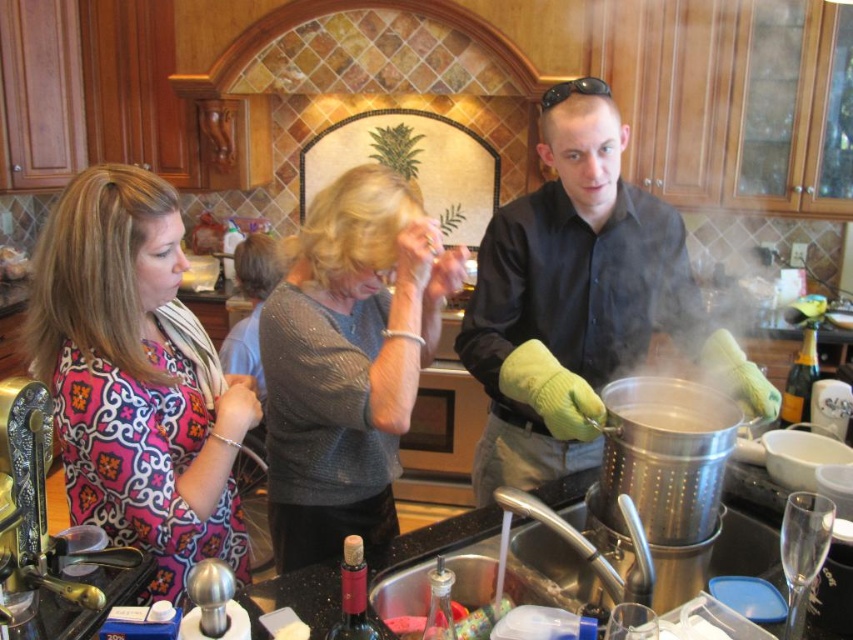
Question: Is matte black shirt at center further to camera compared to sparkly gray sweater at center?

Choices:
 (A) yes
 (B) no

Answer: (A)

Question: Does pink patterned blouse at left have a greater width compared to matte black shirt at center?

Choices:
 (A) no
 (B) yes

Answer: (A)

Question: Which of the following is the closest to the observer?

Choices:
 (A) pink patterned blouse at left
 (B) matte black shirt at center
 (C) sparkly gray sweater at center

Answer: (A)

Question: Which of the following is the farthest from the observer?

Choices:
 (A) matte black shirt at center
 (B) sparkly gray sweater at center

Answer: (A)

Question: Which point is farther from the camera taking this photo?

Choices:
 (A) (289, 272)
 (B) (570, 323)
 (C) (97, 420)

Answer: (B)

Question: Is pink patterned blouse at left to the right of matte black shirt at center from the viewer's perspective?

Choices:
 (A) no
 (B) yes

Answer: (A)